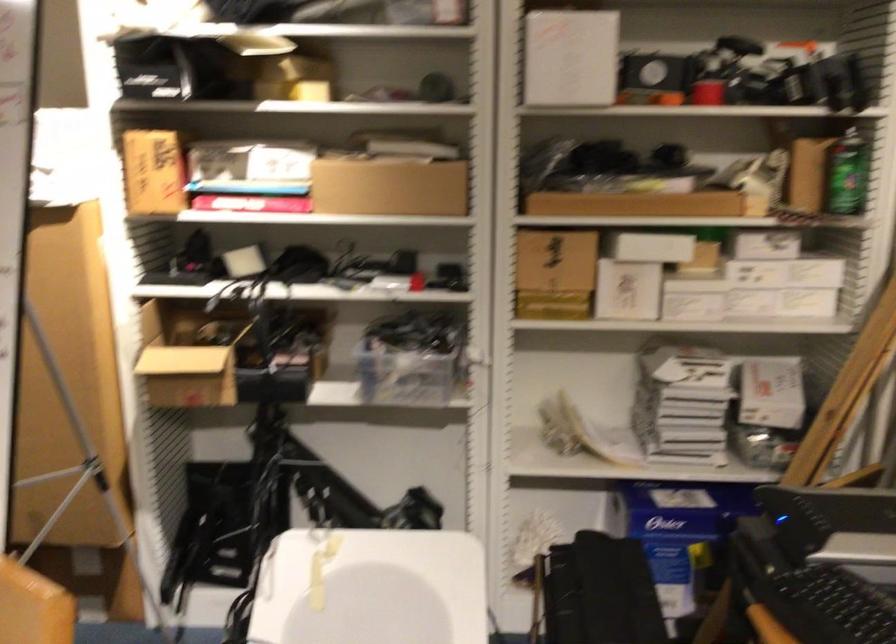
Find the location of a particular element. The height and width of the screenshot is (644, 896). large cardboard box is located at coordinates (73, 412).